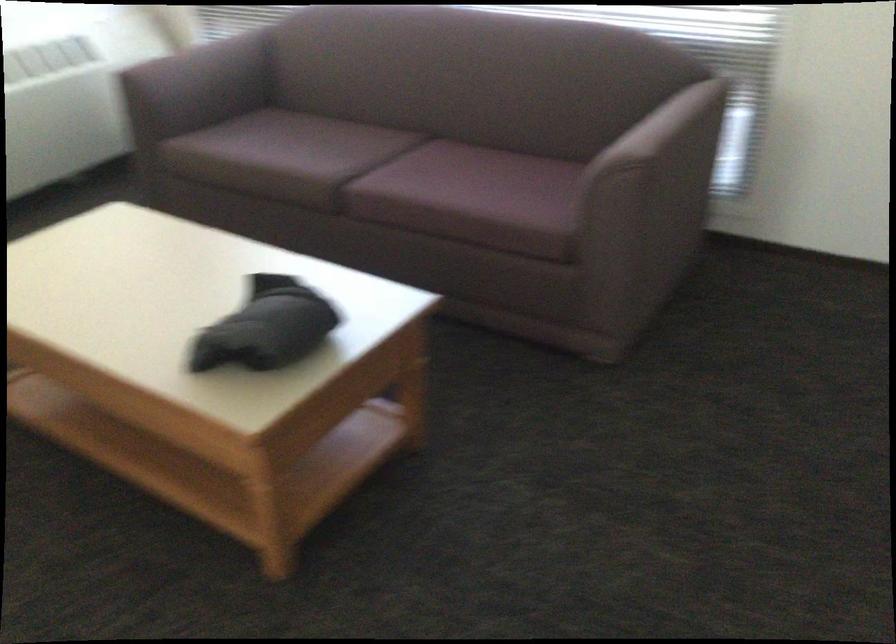
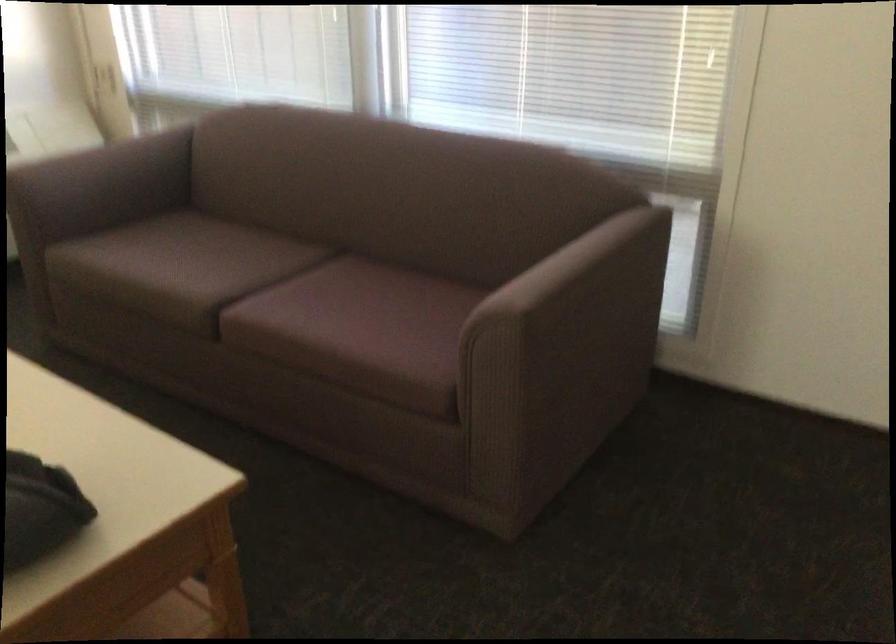
Find the pixel in the second image that matches point (673, 126) in the first image.

(579, 265)